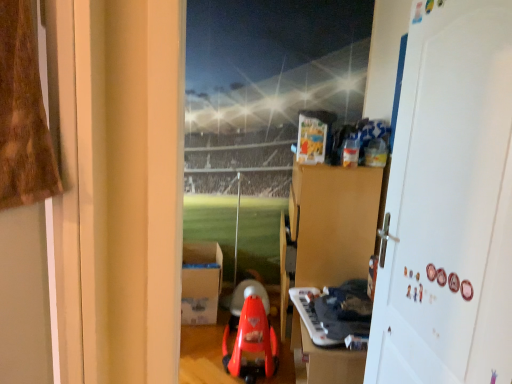
Question: Would you say white matte door at right is to the left or to the right of white plastic keyboard at lower center, which is the first toy from right to left, in the picture?

Choices:
 (A) right
 (B) left

Answer: (A)

Question: Is white matte door at right spatially inside white plastic keyboard at lower center, the second toy when ordered from left to right, or outside of it?

Choices:
 (A) outside
 (B) inside

Answer: (A)

Question: Estimate the real-world distances between objects in this image. Which object is closer to the brown cardboard dresser at upper center?

Choices:
 (A) rubberized red walker at center, acting as the 2th toy starting from the right
 (B) white cardboard box at center
 (C) white matte door at right
 (D) white plastic keyboard at lower center, the second toy when ordered from left to right

Answer: (D)

Question: Which object is positioned closest to the white cardboard box at center?

Choices:
 (A) white plastic keyboard at lower center, which is the first toy from right to left
 (B) rubberized red walker at center, the first toy when ordered from left to right
 (C) white matte door at right
 (D) brown cardboard dresser at upper center

Answer: (B)